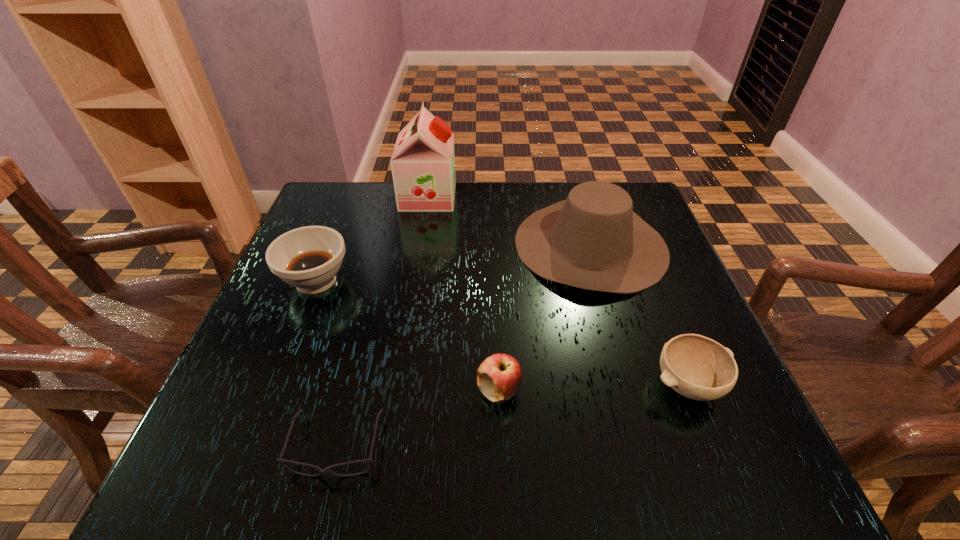
Identify the location of free space that satisfies the following two spatial constraints: 1. with the cap open on the fourth object from left to right; 2. on the left side of the soya milk. (397, 390).

This screenshot has width=960, height=540. Identify the location of free space that satisfies the following two spatial constraints: 1. with the cap open on the bowl; 2. on the left side of the soya milk. (398, 384).

Locate an element on the screen. The image size is (960, 540). free location that satisfies the following two spatial constraints: 1. with the cap open on the tallest object; 2. on the back side of the bowl is located at coordinates (398, 384).

I want to click on vacant space that satisfies the following two spatial constraints: 1. with the cap open on the soya milk; 2. on the front-facing side of the spectacles, so click(x=389, y=448).